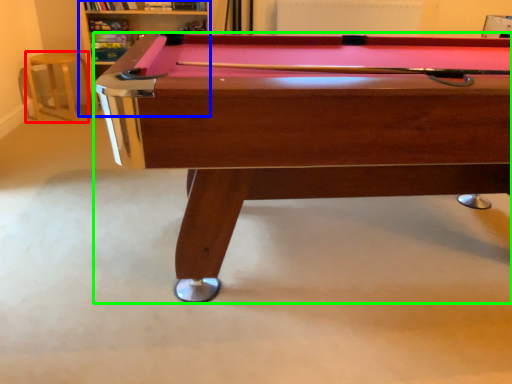
Question: Based on their relative distances, which object is farther from bar stool (highlighted by a red box)? Choose from shelf (highlighted by a blue box) and billiard table (highlighted by a green box).

Choices:
 (A) shelf
 (B) billiard table

Answer: (B)